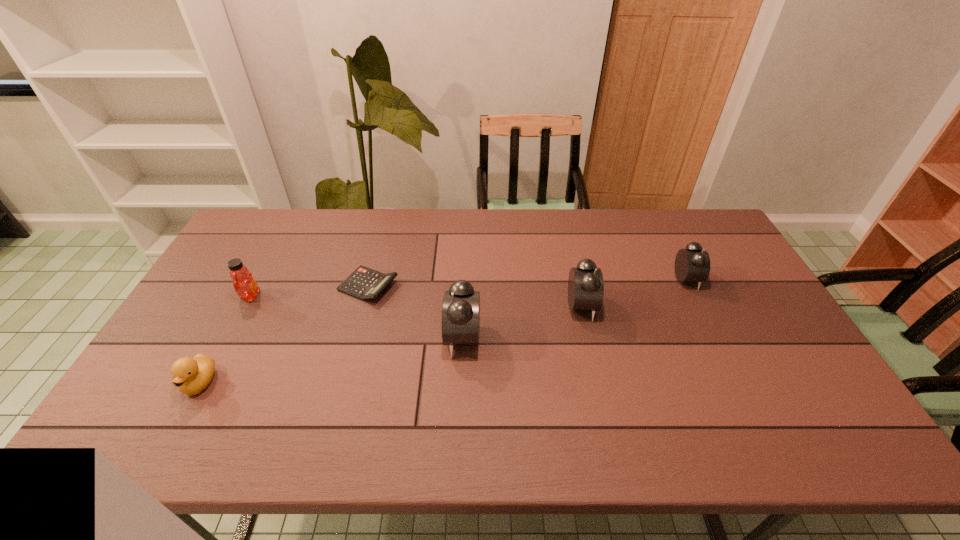
Where is `object at the near left corner`? object at the near left corner is located at coordinates (191, 375).

You are a GUI agent. You are given a task and a screenshot of the screen. Output one action in this format:
    pyautogui.click(x=<x>, y=<y>)
    Task: Click on the vacant position at the far edge of the desktop
    
    Given the screenshot: What is the action you would take?
    pyautogui.click(x=582, y=226)

Where is `free location at the near edge of the desktop`? This screenshot has width=960, height=540. free location at the near edge of the desktop is located at coordinates (435, 396).

In the image, there is a desktop. Find the location of `vacant space at the left edge`. vacant space at the left edge is located at coordinates (216, 341).

This screenshot has height=540, width=960. I want to click on free space at the right edge of the desktop, so click(x=733, y=261).

I want to click on free space at the far left corner of the desktop, so click(281, 217).

In the image, there is a desktop. Identify the location of vacant space at the far right corner. The image size is (960, 540). (684, 225).

You are a GUI agent. You are given a task and a screenshot of the screen. Output one action in this format:
    pyautogui.click(x=<x>, y=<y>)
    Task: Click on the free space at the near right corner of the desktop
    The width and height of the screenshot is (960, 540).
    Given the screenshot: What is the action you would take?
    pyautogui.click(x=788, y=394)

This screenshot has height=540, width=960. I want to click on free space between the nearest object and the fourth object from right to left, so click(284, 334).

Identify the location of free area in between the second object from right to left and the second shortest object. This screenshot has width=960, height=540. (391, 345).